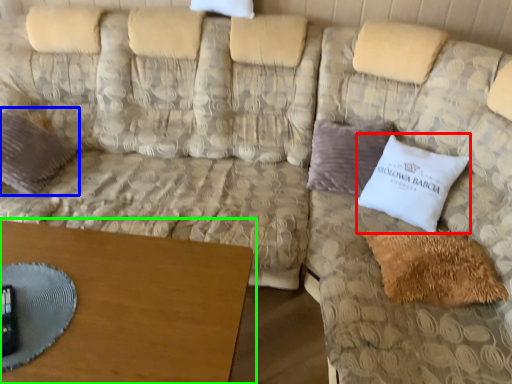
Question: Based on their relative distances, which object is nearer to pillow (highlighted by a red box)? Choose from pillow (highlighted by a blue box) and table (highlighted by a green box).

Choices:
 (A) pillow
 (B) table

Answer: (B)